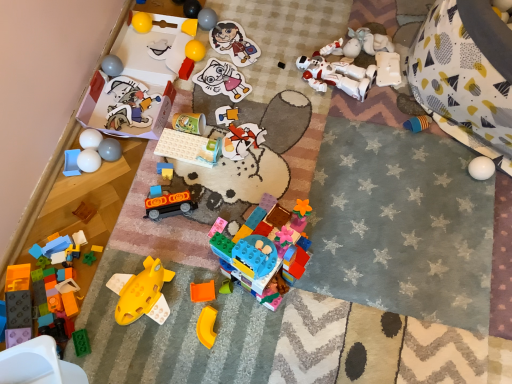
At what (x,y) coordinates should I click in order to perform the action: click on free space between yellow rubber ball at upper center, the tenth toy from the right, and translucent orange plastic at center, arranged as the nineteenth toy when viewed from the left. Please return your answer as a coordinate pair (x, y). Looking at the image, I should click on (205, 142).